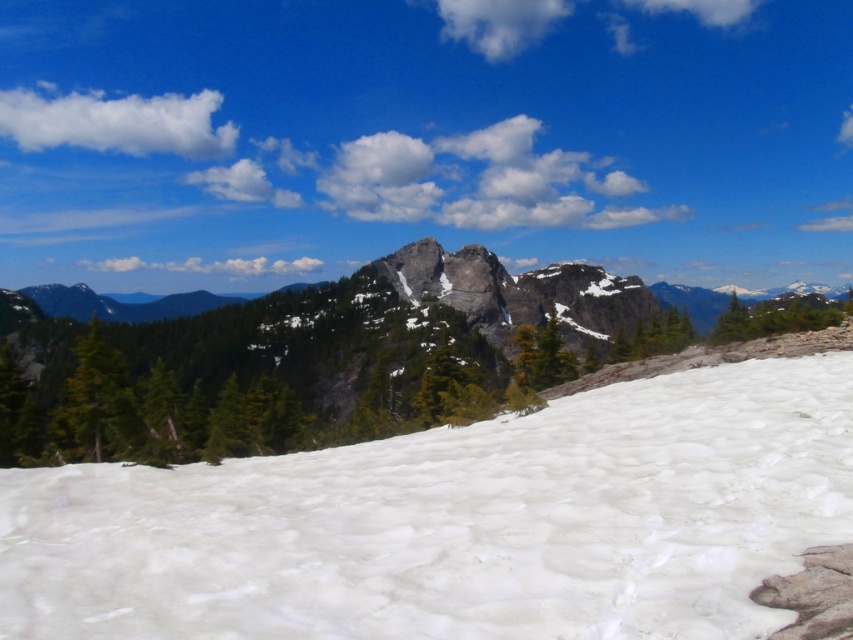
Question: From the image, what is the correct spatial relationship of white snow at center in relation to rocky mountain at center?

Choices:
 (A) above
 (B) below

Answer: (B)

Question: Which object appears farthest from the camera in this image?

Choices:
 (A) rocky mountain at center
 (B) white snow at center

Answer: (A)

Question: Which object is farther from the camera taking this photo?

Choices:
 (A) white snow at center
 (B) rocky mountain at center

Answer: (B)

Question: Can you confirm if white snow at center is positioned above rocky mountain at center?

Choices:
 (A) yes
 (B) no

Answer: (B)

Question: Does white snow at center appear under rocky mountain at center?

Choices:
 (A) yes
 (B) no

Answer: (A)